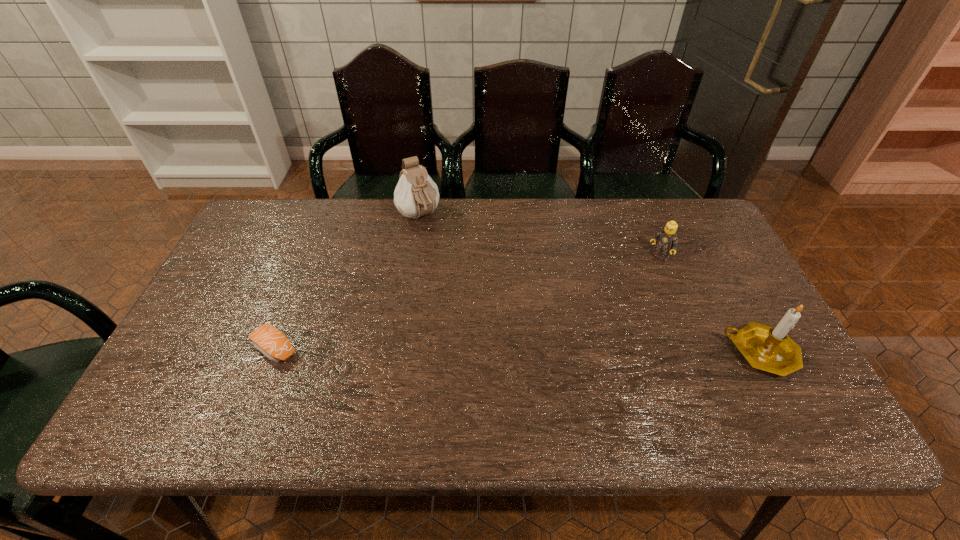
The image size is (960, 540). I want to click on object positioned at the right edge, so click(x=767, y=348).

The width and height of the screenshot is (960, 540). Find the location of `object that is at the near right corner`. object that is at the near right corner is located at coordinates (767, 348).

Find the location of `vacant region at the far edge of the desktop`. vacant region at the far edge of the desktop is located at coordinates (594, 213).

Locate an element on the screen. The image size is (960, 540). vacant space at the near edge of the desktop is located at coordinates (554, 370).

In order to click on vacant space at the left edge in this screenshot , I will do `click(238, 314)`.

You are a GUI agent. You are given a task and a screenshot of the screen. Output one action in this format:
    pyautogui.click(x=<x>, y=<y>)
    Task: Click on the vacant point at the right edge
    This screenshot has height=540, width=960.
    Given the screenshot: What is the action you would take?
    pyautogui.click(x=695, y=289)

Locate an element on the screen. Image resolution: width=960 pixels, height=540 pixels. vacant area at the far left corner of the desktop is located at coordinates (252, 231).

The height and width of the screenshot is (540, 960). In the image, there is a desktop. Identify the location of vacant space at the far right corner. (688, 232).

I want to click on vacant space that's between the sushi and the farthest object, so click(x=348, y=282).

This screenshot has width=960, height=540. I want to click on empty space between the leftmost object and the second object from left to right, so click(348, 282).